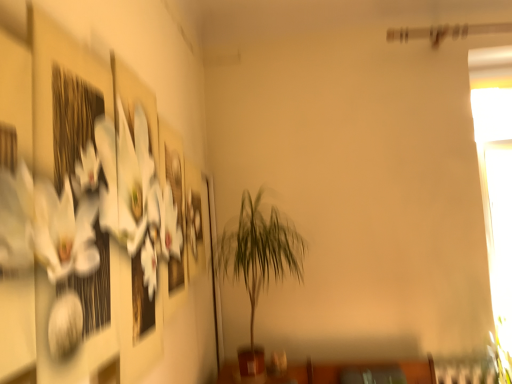
What do you see at coordinates (258, 260) in the screenshot? The height and width of the screenshot is (384, 512). I see `green leafy plant at center` at bounding box center [258, 260].

At what (x,y) coordinates should I click in order to perform the action: click on green leafy plant at center. Please return your answer as a coordinate pair (x, y). The height and width of the screenshot is (384, 512). Looking at the image, I should click on (258, 260).

This screenshot has width=512, height=384. In order to click on green leafy plant at center in this screenshot , I will do `click(258, 260)`.